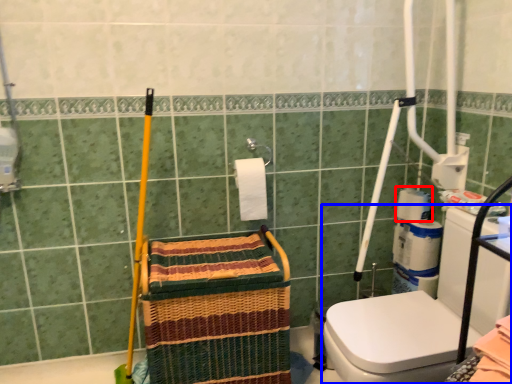
Question: Which point is further to the camera, toilet paper (highlighted by a red box) or washer (highlighted by a blue box)?

Choices:
 (A) toilet paper
 (B) washer

Answer: (A)